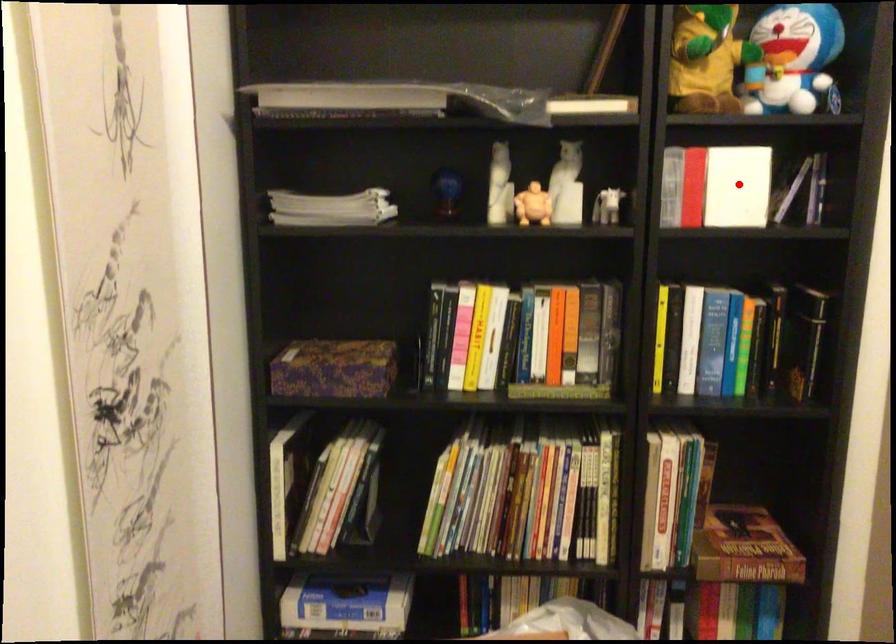
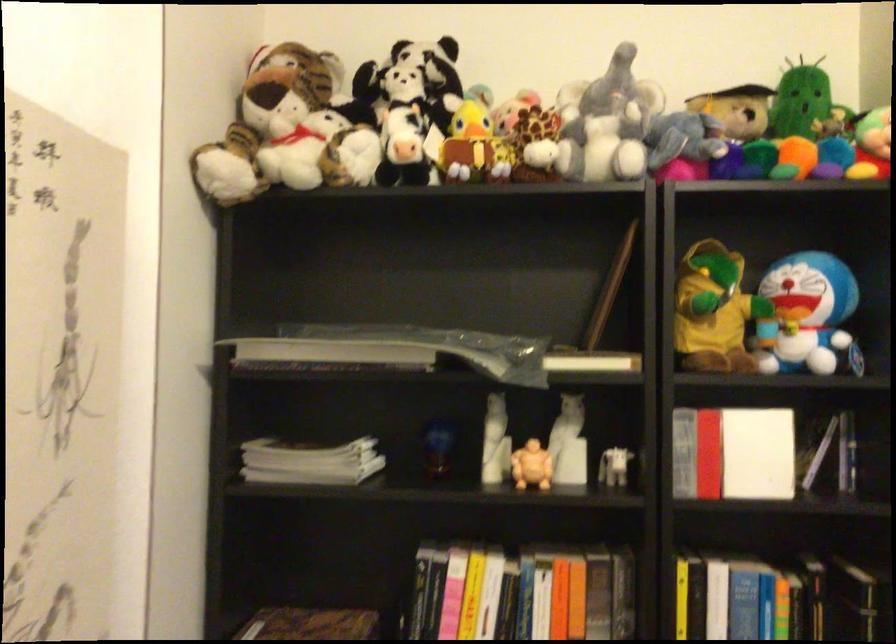
Where in the second image is the point corresponding to the highlighted location from the first image?

(757, 453)